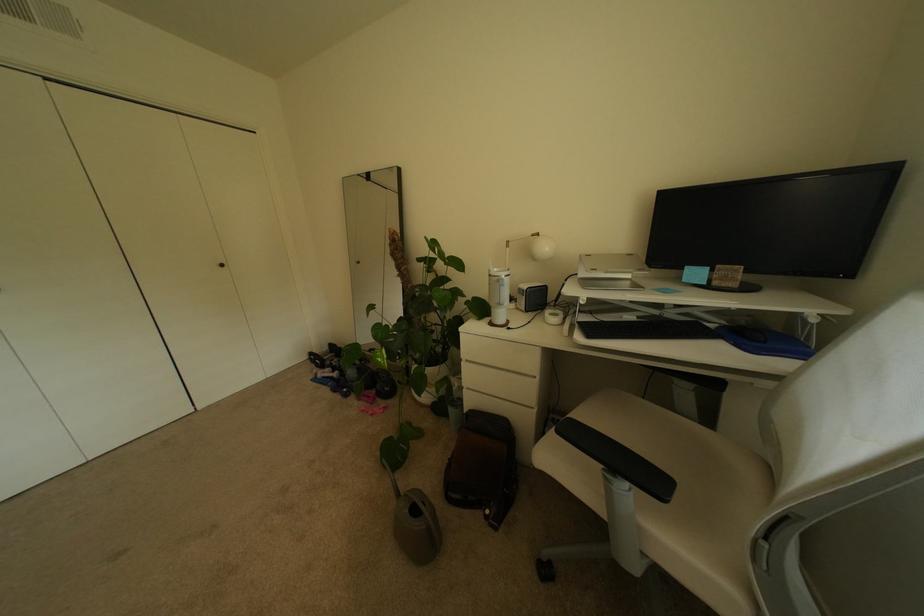
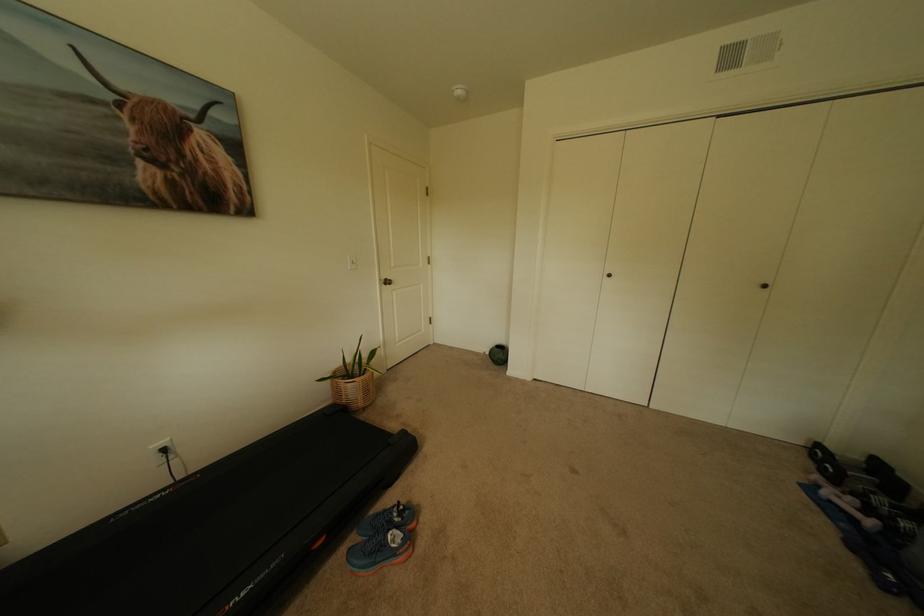
Where in the second image is the point corresponding to [321,358] from the first image?

(827, 452)